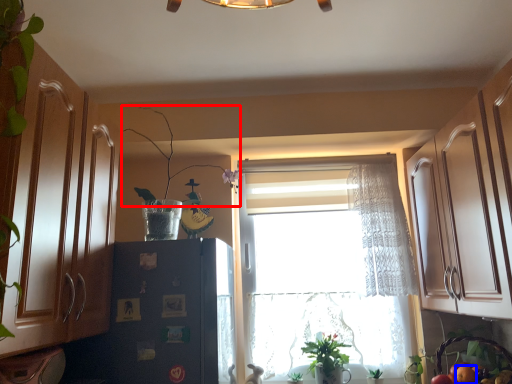
Question: Among these objects, which one is nearest to the camera, plant (highlighted by a red box) or fruit (highlighted by a blue box)?

Choices:
 (A) plant
 (B) fruit

Answer: (A)